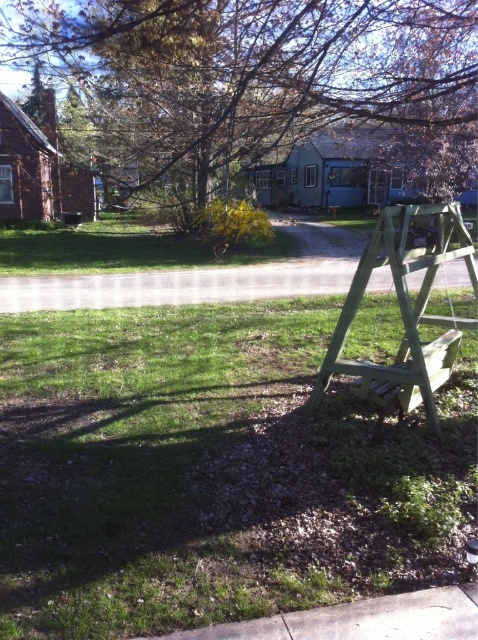
Question: Does green grass at lower center appear on the right side of brown wood tree at upper center?

Choices:
 (A) yes
 (B) no

Answer: (A)

Question: Which point is farther to the camera?

Choices:
 (A) green wood ladder at right
 (B) gray asphalt road at center

Answer: (B)

Question: Can you confirm if brown wood tree at upper center is bigger than gray asphalt road at center?

Choices:
 (A) yes
 (B) no

Answer: (A)

Question: Considering the real-world distances, which object is farthest from the green wood ladder at right?

Choices:
 (A) gray asphalt road at center
 (B) brown wood tree at upper center
 (C) green wooden bench at lower right
 (D) green grass at lower center

Answer: (B)

Question: Estimate the real-world distances between objects in this image. Which object is closer to the green wood ladder at right?

Choices:
 (A) brown wood tree at upper center
 (B) green wooden bench at lower right

Answer: (B)

Question: Where is green wood ladder at right located in relation to gray asphalt road at center in the image?

Choices:
 (A) left
 (B) right

Answer: (B)